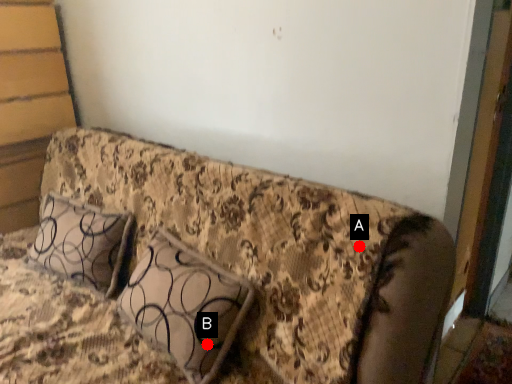
Question: Two points are circled on the image, labeled by A and B beside each circle. Which point is closer to the camera taking this photo?

Choices:
 (A) A is closer
 (B) B is closer

Answer: (A)